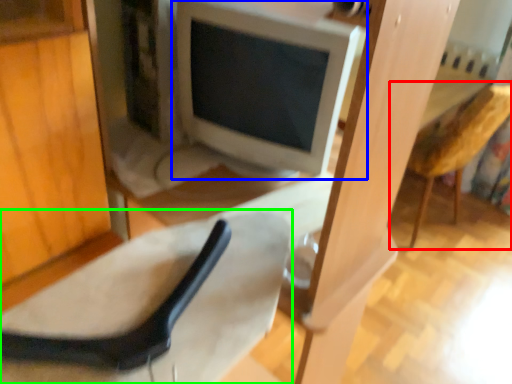
Question: Considering the real-world distances, which object is closest to armchair (highlighted by a red box)? computer monitor (highlighted by a blue box) or chair (highlighted by a green box).

Choices:
 (A) computer monitor
 (B) chair

Answer: (A)